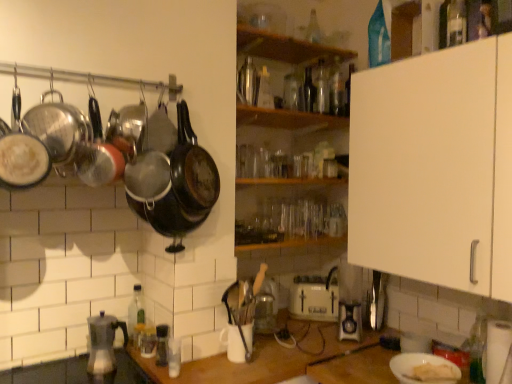
The width and height of the screenshot is (512, 384). I want to click on free space to the right of matte black coffee maker at lower left, acting as the 6th appliance starting from the right, so click(128, 367).